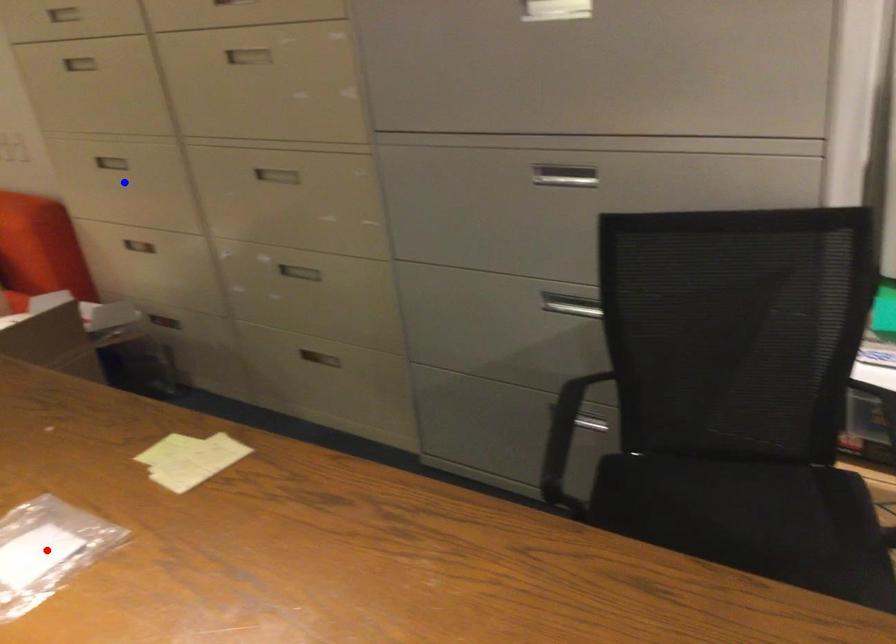
Question: In the image, two points are highlighted. Which point is nearer to the camera? Reply with the corresponding letter.

Choices:
 (A) blue point
 (B) red point

Answer: (B)